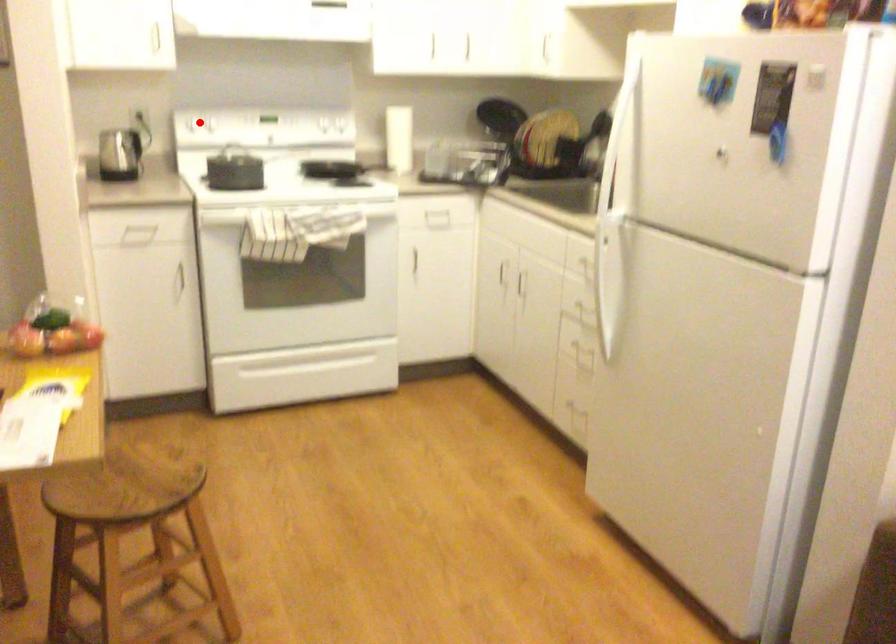
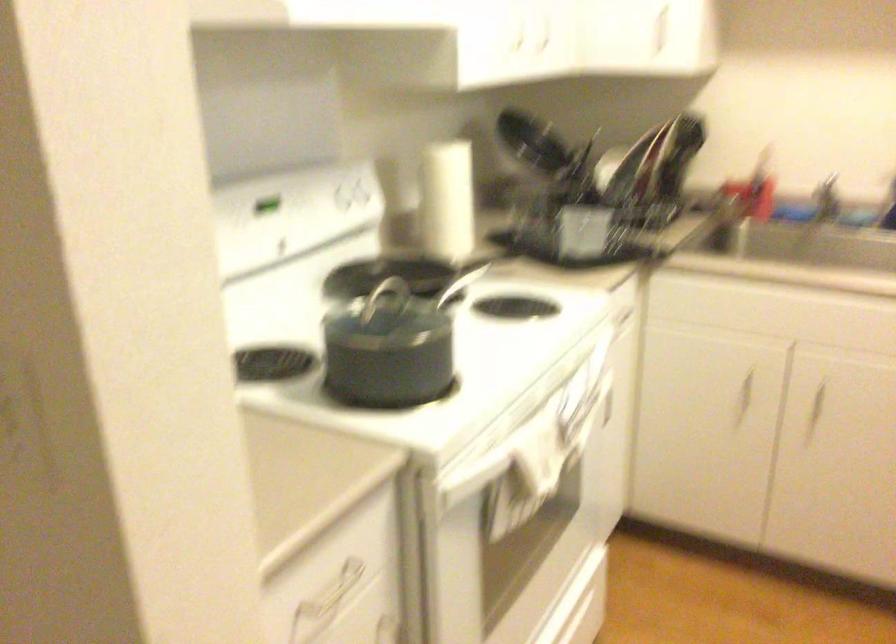
Question: I am providing you with two images of the same scene from different viewpoints. A red point is marked on the first image. Is the red point's position out of view in image 2?

Choices:
 (A) Yes
 (B) No

Answer: (A)